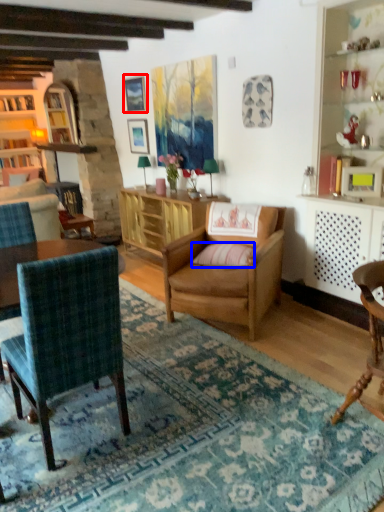
Question: Which of the following is the farthest to the observer, picture frame (highlighted by a red box) or pillow (highlighted by a blue box)?

Choices:
 (A) picture frame
 (B) pillow

Answer: (A)